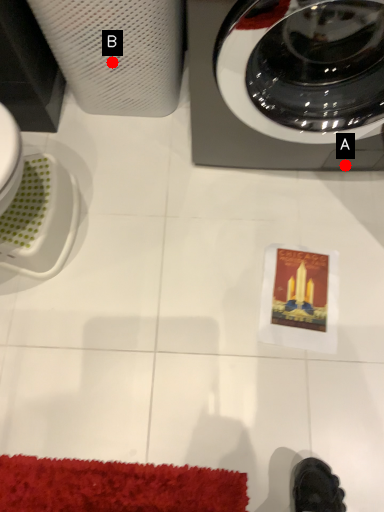
Question: Two points are circled on the image, labeled by A and B beside each circle. Which of the following is the farthest from the observer?

Choices:
 (A) A is further
 (B) B is further

Answer: (A)